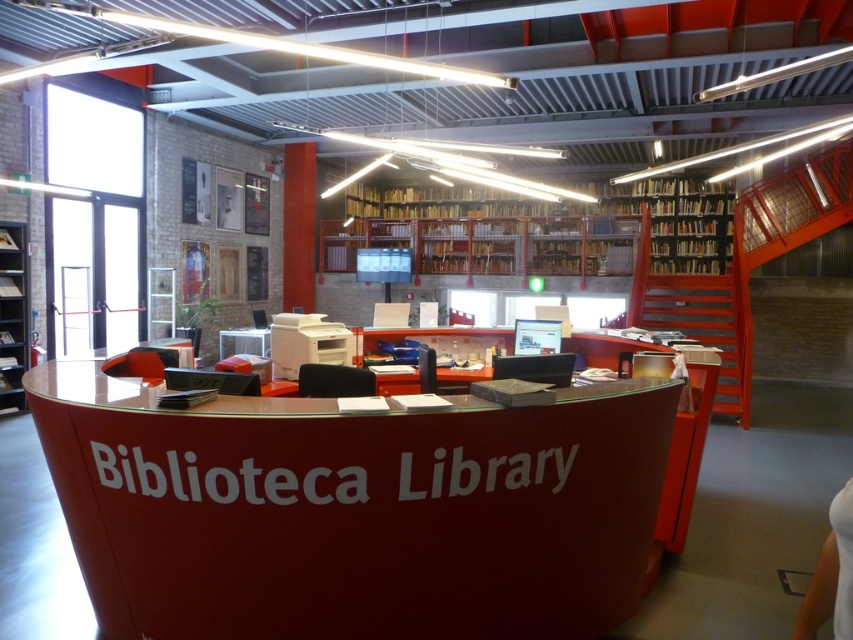
You are a librarian who needs to move a 15 feet long ladder from the glossy red table at center to the metallic gray bookshelf at left. Can you move the ladder without bending it?

→ The distance between the glossy red table at center and the metallic gray bookshelf at left is 18.75 feet. Since the ladder is 15 feet long, it can be moved horizontally between them without bending because the available space is greater than the ladder length.

You are a visitor at the Biblioteca Library and want to find a book. You see the glossy red table at center and the wooden shelves at upper center. Which object is closer to the entrance of the library?

The glossy red table at center is closer to the entrance of the library because it is positioned to the left of the wooden shelves at upper center, which are further away from the entrance.

You are a librarian organizing books in the Biblioteca Library. You need to place a new book on the wooden shelves at upper center. However, you want to ensure that the book won not fall off. What should you check first about the glossy red table at center?

The glossy red table at center is positioned under the wooden shelves at upper center. Therefore, you should check if the glossy red table at center is sturdy enough to support the wooden shelves, ensuring the shelves are securely placed and the book won not fall.